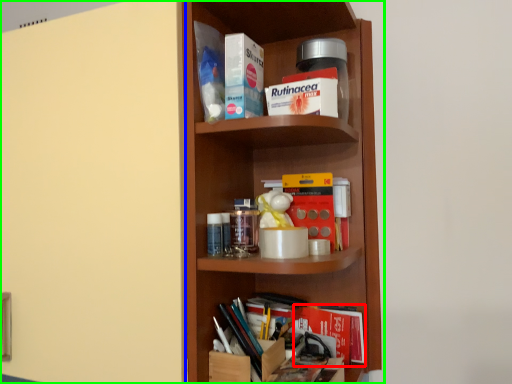
Question: Estimate the real-world distances between objects in this image. Which object is farther from book (highlighted by a red box), door (highlighted by a blue box) or shelf (highlighted by a green box)?

Choices:
 (A) door
 (B) shelf

Answer: (A)